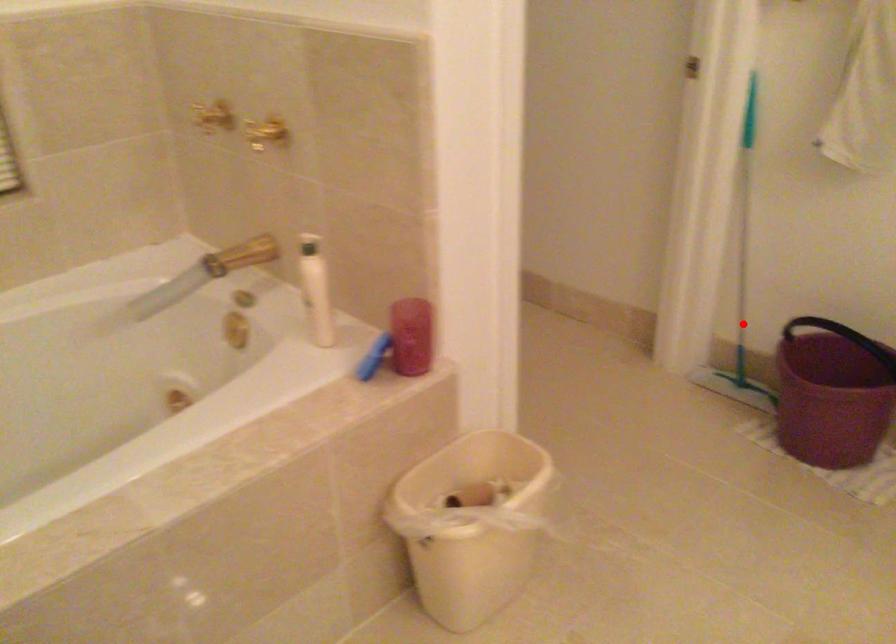
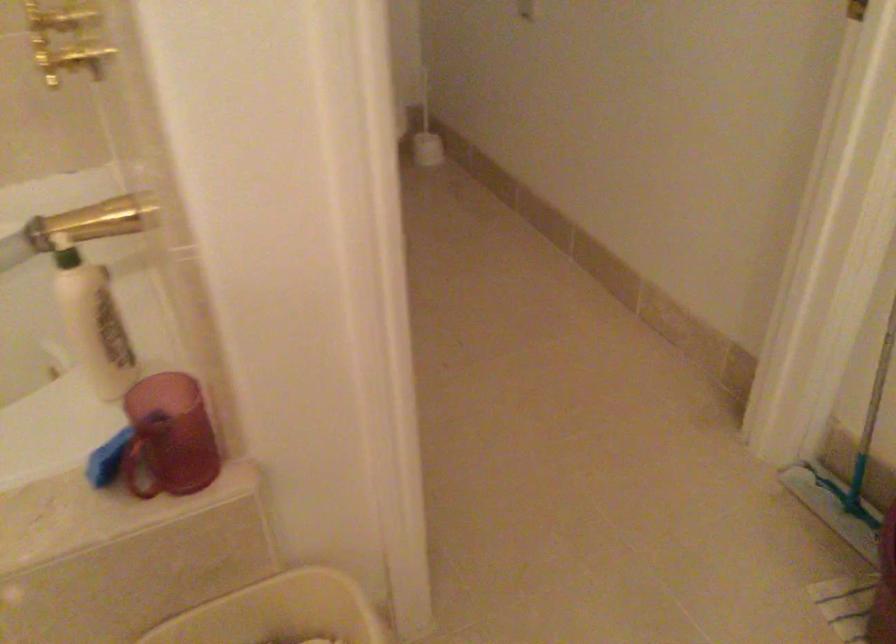
Locate, in the second image, the point that corresponds to the highlighted location in the first image.

(866, 431)